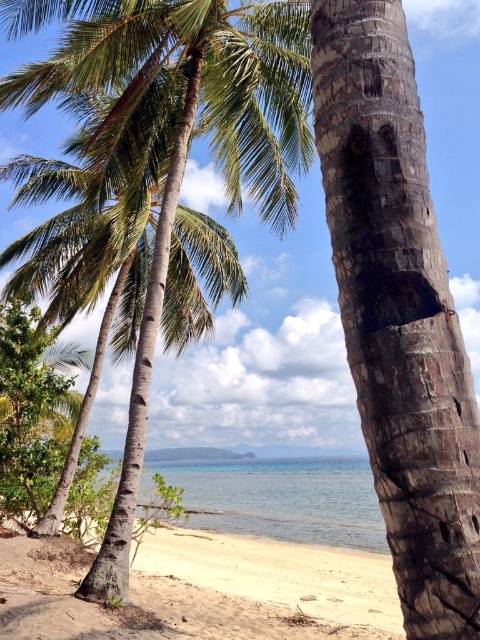
Question: Is green leafy coconut tree at left in front of clear blue water at center?

Choices:
 (A) yes
 (B) no

Answer: (A)

Question: Does green leafy coconut tree at left appear under sandy beach at lower left?

Choices:
 (A) yes
 (B) no

Answer: (B)

Question: Which point is closer to the camera?

Choices:
 (A) (19, 547)
 (B) (391, 273)
 (C) (356, 488)

Answer: (B)

Question: Considering the relative positions of dark brown textured bark at center and clear blue water at center in the image provided, where is dark brown textured bark at center located with respect to clear blue water at center?

Choices:
 (A) below
 (B) above

Answer: (B)

Question: Which of the following is the farthest from the observer?

Choices:
 (A) (10, 4)
 (B) (383, 529)
 (C) (12, 618)

Answer: (B)

Question: Which object is the closest to the sandy beach at lower left?

Choices:
 (A) clear blue water at center
 (B) dark brown textured bark at center

Answer: (B)